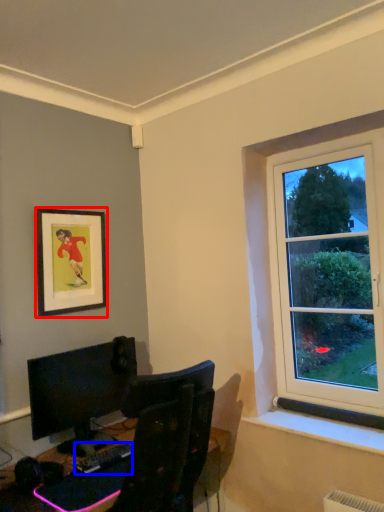
Question: Which point is closer to the camera, picture frame (highlighted by a red box) or computer keyboard (highlighted by a blue box)?

Choices:
 (A) picture frame
 (B) computer keyboard

Answer: (B)